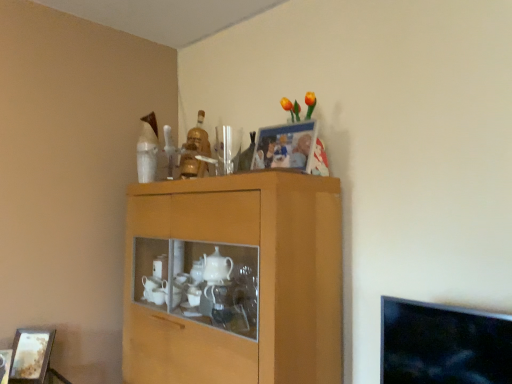
Question: Does wooden cabinet at center appear on the right side of wooden picture frame at lower left, arranged as the 1th picture frame when ordered from the bottom?

Choices:
 (A) no
 (B) yes

Answer: (B)

Question: Can you confirm if wooden cabinet at center is taller than wooden picture frame at lower left, the 1th picture frame viewed from the left?

Choices:
 (A) yes
 (B) no

Answer: (A)

Question: Does wooden cabinet at center lie in front of wooden picture frame at lower left, which appears as the second picture frame when viewed from the right?

Choices:
 (A) yes
 (B) no

Answer: (A)

Question: Can you confirm if wooden cabinet at center is positioned to the left of wooden picture frame at lower left, which is counted as the first picture frame, starting from the back?

Choices:
 (A) no
 (B) yes

Answer: (A)

Question: Does wooden cabinet at center have a lesser height compared to wooden picture frame at lower left, arranged as the second picture frame when viewed from the top?

Choices:
 (A) no
 (B) yes

Answer: (A)

Question: Visually, is wooden cabinet at center positioned to the left or to the right of wooden picture frame at lower left, which appears as the second picture frame when viewed from the right?

Choices:
 (A) right
 (B) left

Answer: (A)

Question: Does point (303, 220) appear closer or farther from the camera than point (31, 345)?

Choices:
 (A) farther
 (B) closer

Answer: (B)

Question: From a real-world perspective, is wooden cabinet at center above or below wooden picture frame at lower left, arranged as the 1th picture frame when ordered from the bottom?

Choices:
 (A) below
 (B) above

Answer: (B)

Question: Considering the positions of wooden cabinet at center and wooden picture frame at lower left, which appears as the second picture frame when viewed from the right, in the image, is wooden cabinet at center taller or shorter than wooden picture frame at lower left, which appears as the second picture frame when viewed from the right,?

Choices:
 (A) tall
 (B) short

Answer: (A)

Question: In terms of size, does wooden cabinet at center appear bigger or smaller than matte plastic picture frame at upper center, placed as the 2th picture frame when sorted from bottom to top?

Choices:
 (A) small
 (B) big

Answer: (B)

Question: Considering their positions, is wooden cabinet at center located in front of or behind matte plastic picture frame at upper center, arranged as the second picture frame when viewed from the left?

Choices:
 (A) front
 (B) behind

Answer: (A)

Question: Is wooden cabinet at center taller or shorter than matte plastic picture frame at upper center, the 1th picture frame viewed from the front?

Choices:
 (A) short
 (B) tall

Answer: (B)

Question: Looking at their shapes, would you say wooden cabinet at center is wider or thinner than matte plastic picture frame at upper center, the 1th picture frame positioned from the right?

Choices:
 (A) wide
 (B) thin

Answer: (A)

Question: Is wooden picture frame at lower left, which appears as the second picture frame when viewed from the right, to the left or to the right of matte plastic picture frame at upper center, the 1th picture frame positioned from the right, in the image?

Choices:
 (A) right
 (B) left

Answer: (B)

Question: Which is correct: wooden picture frame at lower left, which is counted as the first picture frame, starting from the back, is inside matte plastic picture frame at upper center, arranged as the second picture frame when viewed from the left, or outside of it?

Choices:
 (A) inside
 (B) outside

Answer: (B)